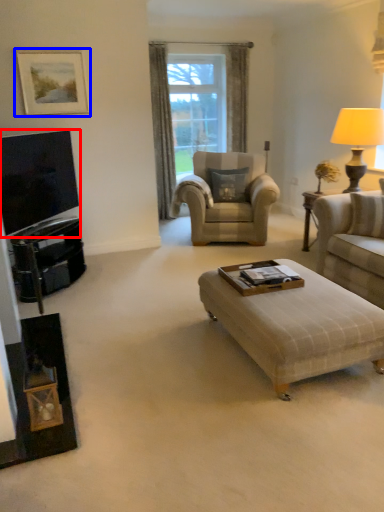
Question: Which object is further to the camera taking this photo, television (highlighted by a red box) or picture frame (highlighted by a blue box)?

Choices:
 (A) television
 (B) picture frame

Answer: (B)